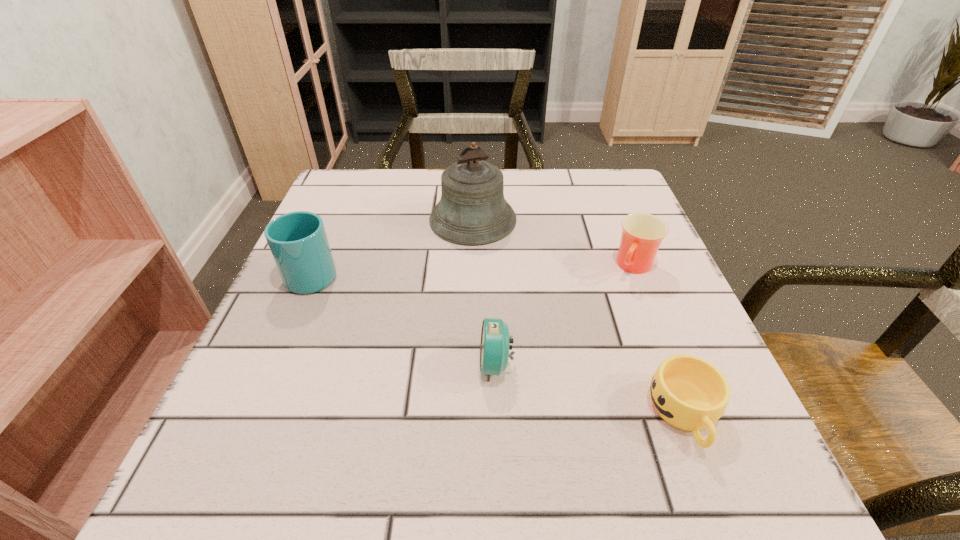
Locate an element on the screen. The width and height of the screenshot is (960, 540). bell is located at coordinates pos(472,210).

Locate an element on the screen. This screenshot has width=960, height=540. the tallest object is located at coordinates (472, 210).

Locate an element on the screen. the second tallest object is located at coordinates pos(298,242).

Locate an element on the screen. the tallest cup is located at coordinates (298, 242).

Locate an element on the screen. The width and height of the screenshot is (960, 540). the second shortest cup is located at coordinates (642, 233).

Image resolution: width=960 pixels, height=540 pixels. In order to click on alarm clock in this screenshot , I will do `click(494, 348)`.

This screenshot has height=540, width=960. Identify the location of the shortest cup. [688, 392].

Locate an element on the screen. The width and height of the screenshot is (960, 540). the shortest object is located at coordinates (688, 392).

Where is `vacant area situated 0.170m on the left of the tallest object`? Image resolution: width=960 pixels, height=540 pixels. vacant area situated 0.170m on the left of the tallest object is located at coordinates (354, 220).

Identify the location of vacant space situated 0.080m on the handle side of the tallest cup. (332, 229).